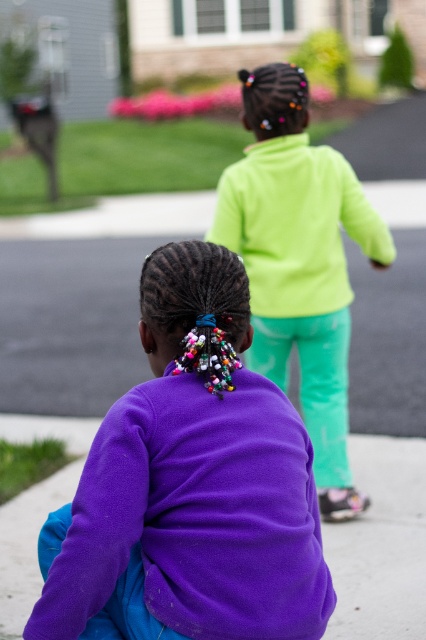
Question: Which point is farther from the camera taking this photo?

Choices:
 (A) (270, 244)
 (B) (311, 518)

Answer: (A)

Question: Does purple fleece jacket at lower left appear under neon green fleece at upper center?

Choices:
 (A) yes
 (B) no

Answer: (A)

Question: Considering the relative positions of purple fleece jacket at lower left and neon green fleece at upper center in the image provided, where is purple fleece jacket at lower left located with respect to neon green fleece at upper center?

Choices:
 (A) right
 (B) left

Answer: (B)

Question: Is purple fleece jacket at lower left above neon green fleece at upper center?

Choices:
 (A) no
 (B) yes

Answer: (A)

Question: Which object is closer to the camera taking this photo?

Choices:
 (A) purple fleece jacket at lower left
 (B) neon green fleece at upper center

Answer: (A)